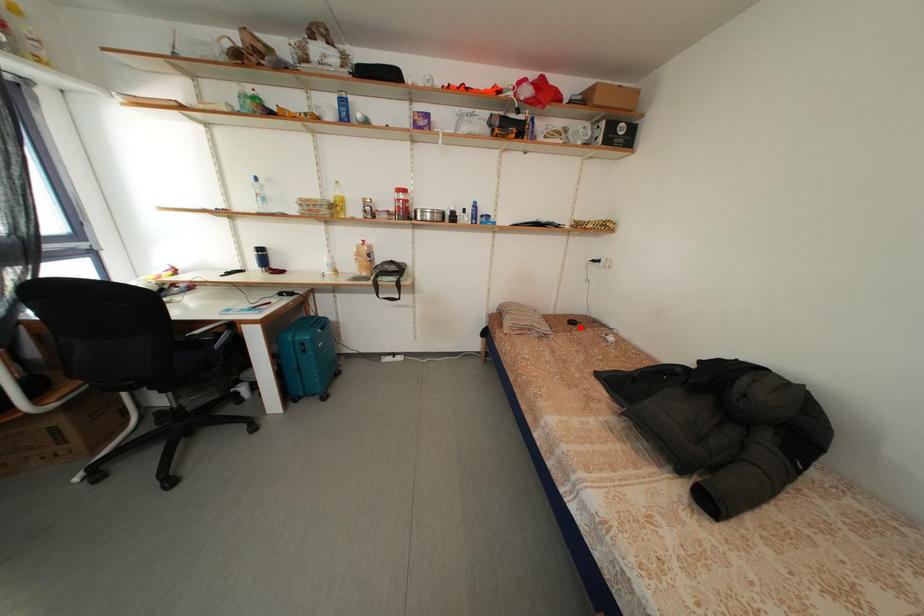
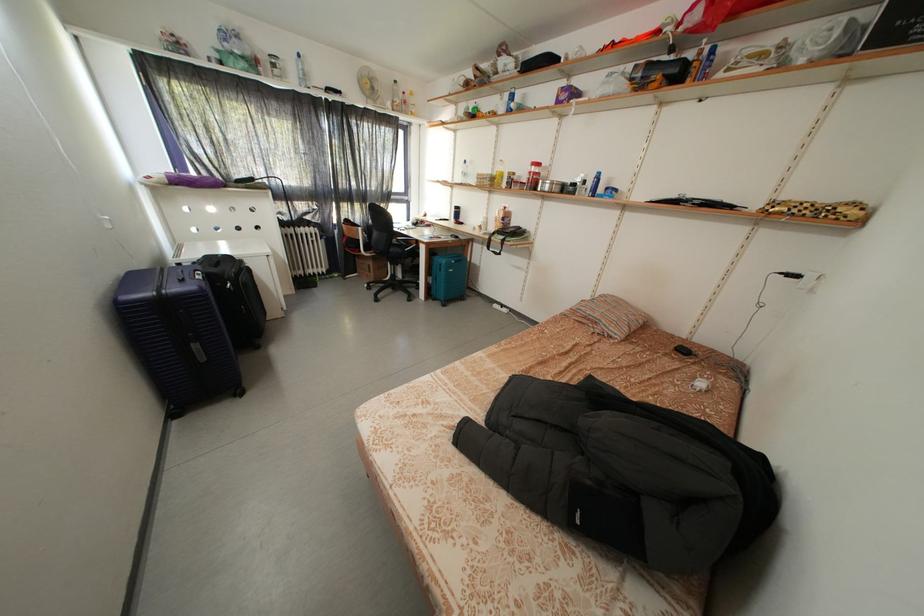
Question: A red point is marked in image1. In image2, is the corresponding 3D point closer to the camera or farther? Reply with the corresponding letter.

Choices:
 (A) The corresponding 3D point is closer.
 (B) The corresponding 3D point is farther.

Answer: (A)